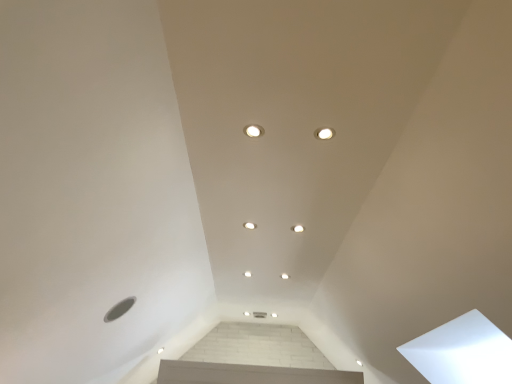
The image size is (512, 384). Describe the element at coordinates (247, 274) in the screenshot. I see `white glossy dot at center, the sixth dot viewed from the right` at that location.

What is the approximate height of white glossy light fixture at upper center, arranged as the 1th dot when viewed from the top?

The height of white glossy light fixture at upper center, arranged as the 1th dot when viewed from the top, is 1.19 inches.

This screenshot has width=512, height=384. I want to click on white glossy light fixture at upper center, which appears as the 6th dot when viewed from the back, so click(324, 133).

This screenshot has width=512, height=384. I want to click on white glossy light fixture at center, which is the 2th dot from top to bottom, so click(x=250, y=225).

Locate an element on the screen. white glossy light fixture at upper center, which ranks as the 3th dot in left-to-right order is located at coordinates (274, 315).

In order to click on white glossy dot at center, which appears as the first dot when viewed from the left in this screenshot , I will do `click(247, 274)`.

What's the angular difference between white glossy light fixture at center, the fifth dot in the front-to-back sequence, and white glossy light fixture at upper center, arranged as the 1th dot when viewed from the top,'s facing directions?

white glossy light fixture at center, the fifth dot in the front-to-back sequence, and white glossy light fixture at upper center, arranged as the 1th dot when viewed from the top, are facing 180 degrees away from each other.

Are white glossy light fixture at center, which is the fifth dot from top to bottom, and white glossy light fixture at upper center, which is the 6th dot from bottom to top, located far from each other?

Absolutely, white glossy light fixture at center, which is the fifth dot from top to bottom, is distant from white glossy light fixture at upper center, which is the 6th dot from bottom to top.

Would you say white glossy light fixture at upper center, which appears as the 6th dot when viewed from the back, is part of white glossy light fixture at center, which is the second dot in bottom-to-top order,'s contents?

No, white glossy light fixture at upper center, which appears as the 6th dot when viewed from the back, is not inside white glossy light fixture at center, which is the second dot in bottom-to-top order.

In the scene shown: Can you confirm if white glossy light fixture at center, which is the fifth dot from top to bottom, is smaller than white glossy light fixture at upper center, which ranks as the 1th dot in right-to-left order?

Yes, white glossy light fixture at center, which is the fifth dot from top to bottom, is smaller than white glossy light fixture at upper center, which ranks as the 1th dot in right-to-left order.

Could you tell me if white glossy light fixture at center, which is the 2th dot from top to bottom, is facing white glossy light fixture at upper center, arranged as the sixth dot when viewed from the left?

Yes, white glossy light fixture at center, which is the 2th dot from top to bottom, is facing white glossy light fixture at upper center, arranged as the sixth dot when viewed from the left.

Does white glossy light fixture at center, placed as the 2th dot when sorted from left to right, have a lesser height compared to white glossy light fixture at upper center, which is the 6th dot from bottom to top?

Indeed, white glossy light fixture at center, placed as the 2th dot when sorted from left to right, has a lesser height compared to white glossy light fixture at upper center, which is the 6th dot from bottom to top.

Is white glossy light fixture at center, the 3th dot from the front, positioned far away from white glossy light fixture at upper center, arranged as the 1th dot when viewed from the top?

Indeed, white glossy light fixture at center, the 3th dot from the front, is not near white glossy light fixture at upper center, arranged as the 1th dot when viewed from the top.

Is white glossy light fixture at upper center, marked as the first dot in a back-to-front arrangement, directly adjacent to white glossy light fixture at center, which appears as the second dot when viewed from the right?

No.

Who is shorter, white glossy light fixture at upper center, positioned as the sixth dot in front-to-back order, or white glossy light fixture at center, the 2th dot in the front-to-back sequence?

With less height is white glossy light fixture at upper center, positioned as the sixth dot in front-to-back order.

Which is correct: white glossy light fixture at upper center, which ranks as the 1th dot in bottom-to-top order, is inside white glossy light fixture at center, acting as the 4th dot starting from the bottom, or outside of it?

white glossy light fixture at upper center, which ranks as the 1th dot in bottom-to-top order, lies outside white glossy light fixture at center, acting as the 4th dot starting from the bottom.

From a real-world perspective, relative to white glossy light fixture at upper center, which appears as the 6th dot when viewed from the back, is white glossy light fixture at upper center, marked as the first dot in a back-to-front arrangement, vertically above or below?

In terms of real-world spatial position, white glossy light fixture at upper center, marked as the first dot in a back-to-front arrangement, is below white glossy light fixture at upper center, which appears as the 6th dot when viewed from the back.

Is white glossy light fixture at upper center, which ranks as the 3th dot in left-to-right order, not near white glossy light fixture at upper center, arranged as the sixth dot when viewed from the left?

white glossy light fixture at upper center, which ranks as the 3th dot in left-to-right order, is far away from white glossy light fixture at upper center, arranged as the sixth dot when viewed from the left.

Considering the positions of objects white glossy light fixture at upper center, positioned as the sixth dot in front-to-back order, and white glossy light fixture at upper center, the 1th dot viewed from the front, in the image provided, who is in front, white glossy light fixture at upper center, positioned as the sixth dot in front-to-back order, or white glossy light fixture at upper center, the 1th dot viewed from the front,?

white glossy light fixture at upper center, the 1th dot viewed from the front, is more forward.

Can you confirm if white glossy light fixture at center, the fifth dot ordered from the bottom, is thinner than white glossy dot at center, which appears as the first dot when viewed from the left?

Yes.

Is white glossy light fixture at center, which is the 2th dot from top to bottom, turned away from white glossy dot at center, which ranks as the 4th dot in front-to-back order?

Correct, white glossy light fixture at center, which is the 2th dot from top to bottom, is looking away from white glossy dot at center, which ranks as the 4th dot in front-to-back order.

Based on their positions, is white glossy light fixture at center, placed as the 2th dot when sorted from left to right, located to the left or right of white glossy dot at center, the sixth dot viewed from the right?

white glossy light fixture at center, placed as the 2th dot when sorted from left to right, is positioned on white glossy dot at center, the sixth dot viewed from the right,'s right side.

Which is in front, point (332, 132) or point (300, 232)?

Positioned in front is point (332, 132).

Is white glossy light fixture at upper center, which appears as the 6th dot when viewed from the back, not close to white glossy light fixture at center, the 5th dot viewed from the left?

No, there isn't a large distance between white glossy light fixture at upper center, which appears as the 6th dot when viewed from the back, and white glossy light fixture at center, the 5th dot viewed from the left.

This screenshot has height=384, width=512. What are the coordinates of `dot in front of the white glossy light fixture at center, acting as the 4th dot starting from the bottom` in the screenshot? It's located at (324, 133).

Is white glossy dot at center, which ranks as the 4th dot in front-to-back order, taller than white glossy light fixture at center, which is the 2th dot from top to bottom?

Yes.

How many degrees apart are the facing directions of white glossy dot at center, the sixth dot viewed from the right, and white glossy light fixture at center, the fifth dot ordered from the bottom?

The angular difference between white glossy dot at center, the sixth dot viewed from the right, and white glossy light fixture at center, the fifth dot ordered from the bottom, is 0.0015 degrees.

Between white glossy dot at center, which ranks as the 4th dot in front-to-back order, and white glossy light fixture at center, which is the 2th dot from top to bottom, which one has larger width?

white glossy dot at center, which ranks as the 4th dot in front-to-back order.

From a real-world perspective, is white glossy dot at center, the sixth dot viewed from the right, located beneath white glossy light fixture at center, which is the 2th dot from top to bottom?

Correct, in the physical world, white glossy dot at center, the sixth dot viewed from the right, is lower than white glossy light fixture at center, which is the 2th dot from top to bottom.

Locate an element on the screen. dot that is the 4th object located behind the white glossy light fixture at upper center, which ranks as the 1th dot in right-to-left order is located at coordinates (284, 276).

The height and width of the screenshot is (384, 512). Identify the location of dot that is the 1st one below the white glossy light fixture at upper center, which appears as the 6th dot when viewed from the back (from a real-world perspective). (250, 225).

From the image, which object appears to be farther from white glossy light fixture at center, which appears as the second dot when viewed from the back, white glossy light fixture at upper center, marked as the first dot in a back-to-front arrangement, or white glossy light fixture at center, acting as the 4th dot starting from the bottom?

Based on the image, white glossy light fixture at upper center, marked as the first dot in a back-to-front arrangement, appears to be further to white glossy light fixture at center, which appears as the second dot when viewed from the back.

Based on their spatial positions, is white glossy light fixture at center, the 3th dot from the front, or white glossy light fixture at center, which is the fifth dot from top to bottom, further from white glossy light fixture at upper center, which ranks as the 1th dot in right-to-left order?

white glossy light fixture at center, which is the fifth dot from top to bottom, is positioned further to the anchor white glossy light fixture at upper center, which ranks as the 1th dot in right-to-left order.

From the image, which object appears to be farther from white glossy light fixture at center, placed as the 4th dot when sorted from back to front, white glossy light fixture at upper center, positioned as the sixth dot in front-to-back order, or white glossy light fixture at upper center, which ranks as the 1th dot in right-to-left order?

white glossy light fixture at upper center, positioned as the sixth dot in front-to-back order, is positioned further to the anchor white glossy light fixture at center, placed as the 4th dot when sorted from back to front.

Estimate the real-world distances between objects in this image. Which object is closer to white glossy light fixture at center, which is counted as the fourth dot, starting from the left, white glossy light fixture at center, the 2th dot in the front-to-back sequence, or white glossy light fixture at upper center, which is counted as the 4th dot, starting from the right?

The object closer to white glossy light fixture at center, which is counted as the fourth dot, starting from the left, is white glossy light fixture at center, the 2th dot in the front-to-back sequence.

Estimate the real-world distances between objects in this image. Which object is further from white glossy light fixture at center, which ranks as the third dot in top-to-bottom order, white glossy dot at center, marked as the third dot in a bottom-to-top arrangement, or white glossy light fixture at upper center, which ranks as the 1th dot in bottom-to-top order?

white glossy light fixture at upper center, which ranks as the 1th dot in bottom-to-top order, is further to white glossy light fixture at center, which ranks as the third dot in top-to-bottom order.

From the image, which object appears to be nearer to white glossy light fixture at upper center, which ranks as the 3th dot in left-to-right order, white glossy dot at center, marked as the 4th dot in a top-to-bottom arrangement, or white glossy light fixture at center, which ranks as the third dot in right-to-left order?

The object closer to white glossy light fixture at upper center, which ranks as the 3th dot in left-to-right order, is white glossy light fixture at center, which ranks as the third dot in right-to-left order.

Estimate the real-world distances between objects in this image. Which object is closer to white glossy dot at center, marked as the third dot in a bottom-to-top arrangement, white glossy light fixture at center, which appears as the second dot when viewed from the right, or white glossy light fixture at center, which appears as the second dot when viewed from the back?

white glossy light fixture at center, which appears as the second dot when viewed from the back.

When comparing their distances from white glossy light fixture at upper center, arranged as the sixth dot when viewed from the left, does white glossy light fixture at center, the 5th dot viewed from the left, or white glossy light fixture at center, which is the 2th dot from top to bottom, seem closer?

white glossy light fixture at center, the 5th dot viewed from the left, is closer to white glossy light fixture at upper center, arranged as the sixth dot when viewed from the left.

Find the location of a particular element. The width and height of the screenshot is (512, 384). dot between white glossy light fixture at center, the 5th dot viewed from the left, and white glossy dot at center, marked as the 4th dot in a top-to-bottom arrangement, along the z-axis is located at coordinates (250, 225).

I want to click on dot between white glossy dot at center, which ranks as the 4th dot in front-to-back order, and white glossy light fixture at upper center, positioned as the sixth dot in front-to-back order, from front to back, so click(284, 276).

The image size is (512, 384). I want to click on dot positioned between white glossy light fixture at upper center, which appears as the 6th dot when viewed from the back, and white glossy light fixture at center, the 5th dot in the right-to-left sequence, from near to far, so [x=297, y=228].

At what (x,y) coordinates should I click in order to perform the action: click on dot between white glossy light fixture at center, placed as the 2th dot when sorted from left to right, and white glossy light fixture at center, which is the second dot in bottom-to-top order, along the z-axis. Please return your answer as a coordinate pair (x, y). The width and height of the screenshot is (512, 384). Looking at the image, I should click on (247, 274).